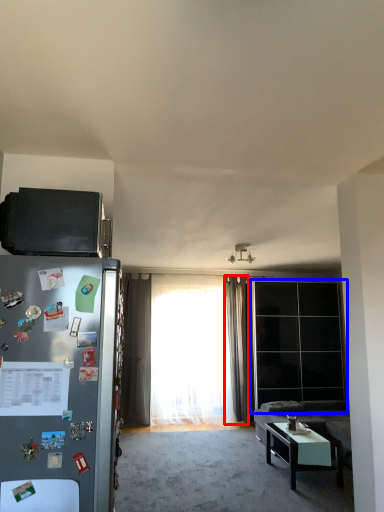
Question: Which point is closer to the camera, curtain (highlighted by a red box) or glass door (highlighted by a blue box)?

Choices:
 (A) curtain
 (B) glass door

Answer: (B)